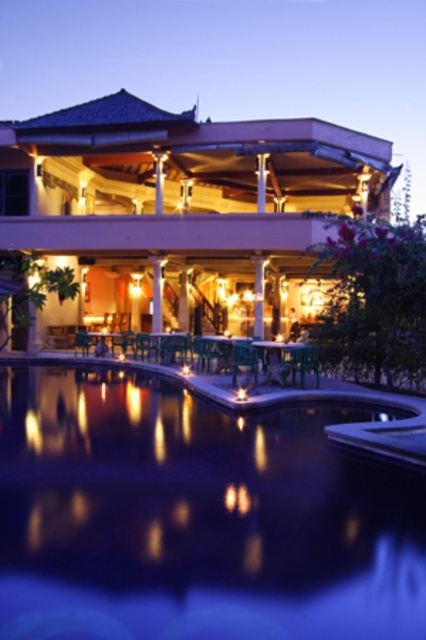
You are standing in the pool area and want to walk from the green chairs to the upper level patio. Which direction should you move relative to the two points, point 1 at (106,230) and point 2 at (301,356)?

You should move towards point 2 at (301,356) because it is further away from you, indicating the direction towards the upper level patio.

You are standing at the edge of the curved swimming pool in the foreground of the image. There is a wooden patio at center marked by point (181,211). If you walk straight towards the wooden patio at center, will you reach it before reaching the building?

The wooden patio at center is located between you and the building, so walking straight towards it will lead you to the patio before reaching the building.

You are standing at the wooden patio at center and want to reach the pool edge. The pool is 17.69 meters away. If you can walk at 1.5 meters per second, how long will it take you to reach the pool edge?

It will take approximately 11.8 seconds to reach the pool edge, calculated by dividing the distance of 17.69 meters by the walking speed of 1.5 meters per second.